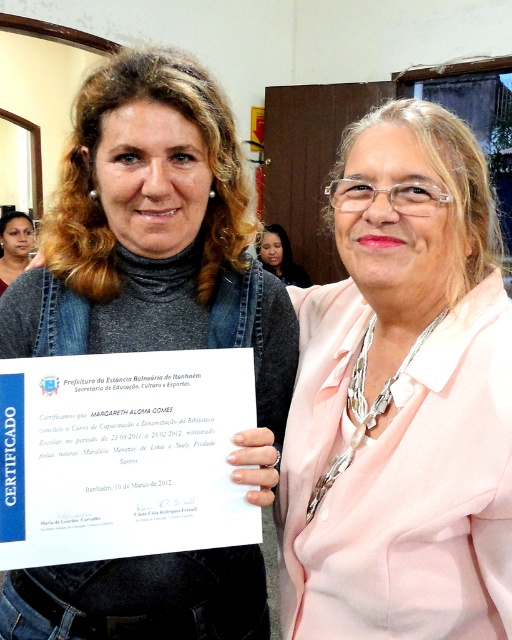
You are a photographer setting up for a group photo. You notice the pink satin blazer at center and the matte black hair at center. Which object should you position closer to the right side of the frame to align with their current positions?

The pink satin blazer at center should be positioned closer to the right side of the frame because it is already to the right of the matte black hair at center.

You are a photographer setting up for a group photo. You want to ensure that the pink satin blazer at center is clearly visible in the shot. What is the minimum distance you should stand from the subject to capture the blazer without it being cropped out?

The pink satin blazer at center is 29.50 inches away from the viewer. To ensure it is fully visible without cropping, the photographer should position themselves at least 29.50 inches away from the subject.